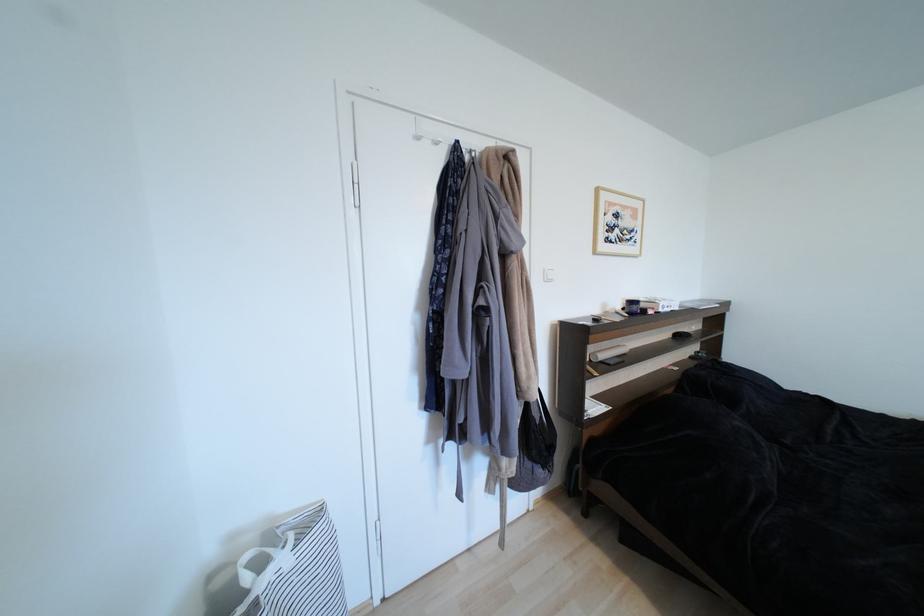
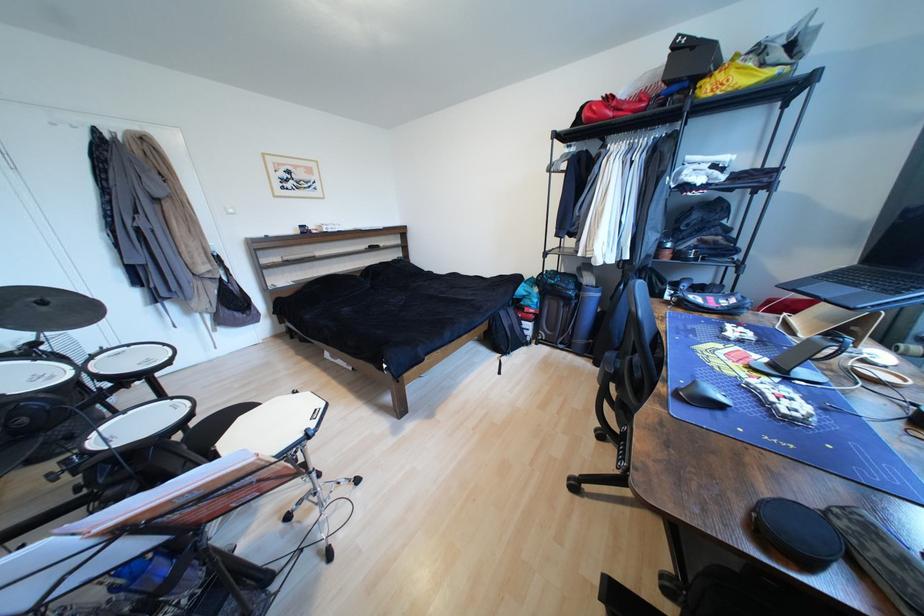
The images are taken continuously from a first-person perspective. In which direction are you moving?

The cameraman moved toward right, backward.